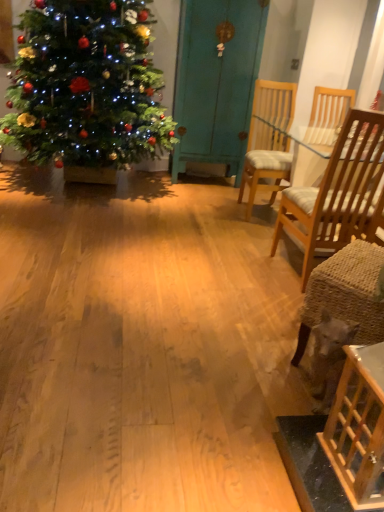
Locate an element on the screen. This screenshot has width=384, height=512. vacant area that is in front of shiny green christmas tree at left is located at coordinates (91, 238).